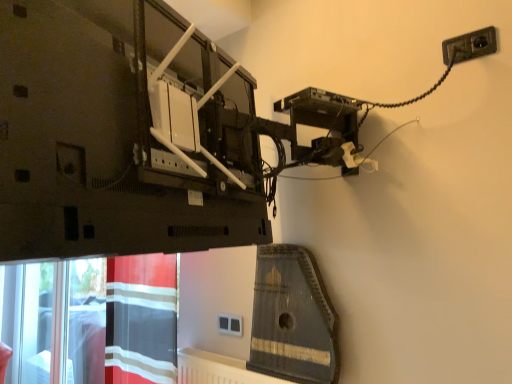
In order to face wooden harp at center, should I rotate leftwards or rightwards?

Turn right approximately 4.762 degrees to face it.

The image size is (512, 384). In order to click on white plastic socket at center in this screenshot , I will do (230, 324).

In the image, is wooden harp at center on the left side or the right side of white plastic socket at center?

Clearly, wooden harp at center is on the right of white plastic socket at center in the image.

Image resolution: width=512 pixels, height=384 pixels. I want to click on socket that is behind the wooden harp at center, so click(x=230, y=324).

Would you say wooden harp at center is a long distance from white plastic socket at center?

wooden harp at center is actually quite close to white plastic socket at center.

Is wooden harp at center looking in the opposite direction of white plastic socket at center?

No, wooden harp at center is not facing away from white plastic socket at center.

Is black plastic socket at upper right looking in the opposite direction of wooden harp at center?

No, black plastic socket at upper right is not facing away from wooden harp at center.

How many degrees apart are the facing directions of black plastic socket at upper right and wooden harp at center?

They differ by 0.0241 degrees in their facing directions.

Does black plastic socket at upper right touch wooden harp at center?

black plastic socket at upper right and wooden harp at center are not in contact.

Which is in front, black plastic socket at upper right or wooden harp at center?

black plastic socket at upper right is closer to the camera.

Considering the relative sizes of wooden harp at center and red striped fabric at lower left in the image provided, is wooden harp at center smaller than red striped fabric at lower left?

Correct, wooden harp at center occupies less space than red striped fabric at lower left.

Consider the image. Which object is further away from the camera taking this photo, wooden harp at center or red striped fabric at lower left?

red striped fabric at lower left is further away from the camera.

Is red striped fabric at lower left surrounded by wooden harp at center?

No, wooden harp at center does not contain red striped fabric at lower left.

Between white plastic socket at center and black plastic socket at upper right, which one appears on the left side from the viewer's perspective?

Positioned to the left is white plastic socket at center.

Find the location of a particular element. The image size is (512, 384). power plugs and sockets lying above the white plastic socket at center (from the image's perspective) is located at coordinates (469, 46).

Is white plastic socket at center bigger than black plastic socket at upper right?

No.

Considering the sizes of objects white plastic socket at center and black plastic socket at upper right in the image provided, who is thinner, white plastic socket at center or black plastic socket at upper right?

Thinner between the two is white plastic socket at center.

Does red striped fabric at lower left have a lesser height compared to white plastic socket at center?

In fact, red striped fabric at lower left may be taller than white plastic socket at center.

From the image's perspective, would you say red striped fabric at lower left is shown under white plastic socket at center?

No.

Considering the relative positions of red striped fabric at lower left and white plastic socket at center in the image provided, is red striped fabric at lower left to the left of white plastic socket at center from the viewer's perspective?

Yes, red striped fabric at lower left is to the left of white plastic socket at center.

Are red striped fabric at lower left and white plastic socket at center far apart?

No, red striped fabric at lower left is not far from white plastic socket at center.

In the image, is white plastic socket at center positioned in front of or behind red striped fabric at lower left?

white plastic socket at center is behind red striped fabric at lower left.

Are white plastic socket at center and red striped fabric at lower left located far from each other?

No, white plastic socket at center is not far from red striped fabric at lower left.

Which is farther, [224,314] or [114,344]?

Point [114,344]

From the picture: From the image's perspective, relative to wooden harp at center, is red striped fabric at lower left above or below?

Based on their image positions, red striped fabric at lower left is located beneath wooden harp at center.

In the scene shown: Is red striped fabric at lower left oriented away from wooden harp at center?

red striped fabric at lower left is not turned away from wooden harp at center.

Which is in front, red striped fabric at lower left or wooden harp at center?

wooden harp at center is closer to the camera.

Considering the relative sizes of red striped fabric at lower left and wooden harp at center in the image provided, is red striped fabric at lower left bigger than wooden harp at center?

Indeed, red striped fabric at lower left has a larger size compared to wooden harp at center.

Image resolution: width=512 pixels, height=384 pixels. I want to click on socket located behind the wooden harp at center, so click(230, 324).

Where is `instrument on the left of black plastic socket at upper right`? instrument on the left of black plastic socket at upper right is located at coordinates (292, 318).

Looking at the image, which one is located further to wooden harp at center, red striped fabric at lower left or black plastic socket at upper right?

The object further to wooden harp at center is black plastic socket at upper right.

Estimate the real-world distances between objects in this image. Which object is closer to wooden harp at center, black plastic socket at upper right or white plastic socket at center?

The object closer to wooden harp at center is white plastic socket at center.

Based on their spatial positions, is wooden harp at center or white plastic socket at center further from red striped fabric at lower left?

wooden harp at center is further to red striped fabric at lower left.

From the image, which object appears to be nearer to white plastic socket at center, red striped fabric at lower left or black plastic socket at upper right?

The object closer to white plastic socket at center is red striped fabric at lower left.

Based on their spatial positions, is wooden harp at center or red striped fabric at lower left closer to white plastic socket at center?

The object closer to white plastic socket at center is wooden harp at center.

Looking at the image, which one is located closer to wooden harp at center, black plastic socket at upper right or red striped fabric at lower left?

red striped fabric at lower left is positioned closer to the anchor wooden harp at center.

Looking at the image, which one is located further to black plastic socket at upper right, wooden harp at center or white plastic socket at center?

The object further to black plastic socket at upper right is white plastic socket at center.

Based on their spatial positions, is red striped fabric at lower left or white plastic socket at center closer to black plastic socket at upper right?

Based on the image, white plastic socket at center appears to be nearer to black plastic socket at upper right.

Find the location of a particular element. The width and height of the screenshot is (512, 384). socket situated between red striped fabric at lower left and black plastic socket at upper right from left to right is located at coordinates (x=230, y=324).

What are the coordinates of `socket between red striped fabric at lower left and wooden harp at center in the horizontal direction` in the screenshot? It's located at (230, 324).

Locate an element on the screen. instrument between red striped fabric at lower left and black plastic socket at upper right from left to right is located at coordinates (292, 318).

Where is `instrument between black plastic socket at upper right and white plastic socket at center in the up-down direction`? instrument between black plastic socket at upper right and white plastic socket at center in the up-down direction is located at coordinates (292, 318).